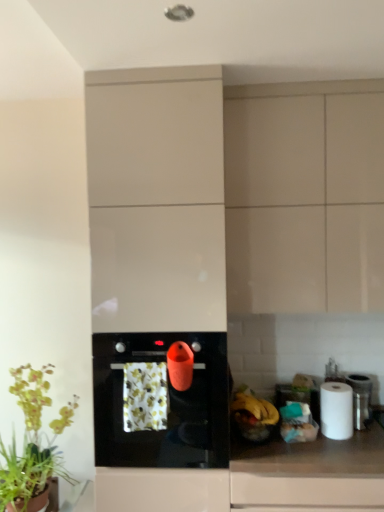
Measure the distance between floral-patterned fabric at center and camera.

floral-patterned fabric at center is 5.84 feet from camera.

Describe the element at coordinates (167, 403) in the screenshot. I see `black glossy oven at center` at that location.

Consider the image. What is the approximate height of white glossy countertop at lower right?

It is 25.28 inches.

Locate an element on the screen. green leafy plant at lower left is located at coordinates (33, 444).

Between white matte paper towel at right and black glossy oven at center, which one appears on the left side from the viewer's perspective?

Positioned to the left is black glossy oven at center.

Is point (336, 430) in front of point (199, 369)?

No, (336, 430) is further to viewer.

From the image's perspective, which one is positioned lower, white matte paper towel at right or black glossy oven at center?

white matte paper towel at right, from the image's perspective.

Can you confirm if yellow matte banana at lower right, which is counted as the 2th banana, starting from the right, is taller than floral-patterned fabric at center?

No.

How many degrees apart are the facing directions of yellow matte banana at lower right, which is counted as the 2th banana, starting from the right, and floral-patterned fabric at center?

35.8 degrees separate the facing orientations of yellow matte banana at lower right, which is counted as the 2th banana, starting from the right, and floral-patterned fabric at center.

Measure the distance from yellow matte banana at lower right, the 1th banana when ordered from left to right, to floral-patterned fabric at center.

yellow matte banana at lower right, the 1th banana when ordered from left to right, is 17.45 inches from floral-patterned fabric at center.

Is yellow matte banana at lower right, which is counted as the 2th banana, starting from the right, oriented towards floral-patterned fabric at center?

No, yellow matte banana at lower right, which is counted as the 2th banana, starting from the right, is not turned towards floral-patterned fabric at center.

Between white matte paper towel at right and yellow matte banana at lower right, the 1th banana when ordered from left to right, which one has smaller size?

yellow matte banana at lower right, the 1th banana when ordered from left to right.

How far apart are white matte paper towel at right and yellow matte banana at lower right, the 1th banana when ordered from left to right?

white matte paper towel at right is 11.81 inches away from yellow matte banana at lower right, the 1th banana when ordered from left to right.

From the picture: Is white matte paper towel at right at the left side of yellow matte banana at lower right, which is counted as the 2th banana, starting from the right?

No.

Is yellow matte banana at right, which is counted as the first banana, starting from the right, further to the viewer compared to yellow matte banana at lower right, which is counted as the 2th banana, starting from the right?

No.

From a real-world perspective, is yellow matte banana at right, which is counted as the first banana, starting from the right, positioned above or below yellow matte banana at lower right, the 1th banana when ordered from left to right?

Clearly, from a real-world perspective, yellow matte banana at right, which is counted as the first banana, starting from the right, is below yellow matte banana at lower right, the 1th banana when ordered from left to right.

Between yellow matte banana at right, which is the second banana from left to right, and yellow matte banana at lower right, the 1th banana when ordered from left to right, which one appears on the left side from the viewer's perspective?

yellow matte banana at lower right, the 1th banana when ordered from left to right.

Who is taller, yellow matte banana at right, which is counted as the first banana, starting from the right, or yellow matte banana at lower right, the 1th banana when ordered from left to right?

With more height is yellow matte banana at right, which is counted as the first banana, starting from the right.

Is white glossy cabinet at center, acting as the 1th cabinetry starting from the left, facing towards yellow matte banana at lower right, which is counted as the 2th banana, starting from the right?

No, white glossy cabinet at center, acting as the 1th cabinetry starting from the left, does not turn towards yellow matte banana at lower right, which is counted as the 2th banana, starting from the right.

Which object is positioned more to the right, white glossy cabinet at center, which is the second cabinetry from right to left, or yellow matte banana at lower right, the 1th banana when ordered from left to right?

yellow matte banana at lower right, the 1th banana when ordered from left to right.

Between white glossy cabinet at center, which is the second cabinetry from right to left, and yellow matte banana at lower right, the 1th banana when ordered from left to right, which one has smaller size?

Smaller between the two is yellow matte banana at lower right, the 1th banana when ordered from left to right.

Between point (87, 160) and point (271, 419), which one is positioned in front?

The point (271, 419) is more forward.

At what (x,y) coordinates should I click in order to perform the action: click on kitchen appliance lying below the floral-patterned fabric at center (from the image's perspective). Please return your answer as a coordinate pair (x, y). Looking at the image, I should click on (167, 403).

Is black glossy oven at center facing away from floral-patterned fabric at center?

Yes, black glossy oven at center is facing away from floral-patterned fabric at center.

From their relative heights in the image, would you say black glossy oven at center is taller or shorter than floral-patterned fabric at center?

Considering their sizes, black glossy oven at center has more height than floral-patterned fabric at center.

Between matte beige cabinet at upper right, acting as the 2th cabinetry starting from the left, and metallic silver canister at right, which one has larger size?

With larger size is matte beige cabinet at upper right, acting as the 2th cabinetry starting from the left.

From the image's perspective, is matte beige cabinet at upper right, the first cabinetry when ordered from right to left, located above metallic silver canister at right?

Correct, matte beige cabinet at upper right, the first cabinetry when ordered from right to left, appears higher than metallic silver canister at right in the image.

Is matte beige cabinet at upper right, acting as the 2th cabinetry starting from the left, looking in the opposite direction of metallic silver canister at right?

No, matte beige cabinet at upper right, acting as the 2th cabinetry starting from the left, is not facing away from metallic silver canister at right.

Where is `paper towel to the right of black glossy oven at center`? paper towel to the right of black glossy oven at center is located at coordinates (336, 410).

Identify the location of the 1st banana below the floral-patterned fabric at center (from the image's perspective). (255, 408).

Based on their spatial positions, is white matte paper towel at right or floral-patterned fabric at center further from white glossy cabinet at center, which is the second cabinetry from right to left?

white matte paper towel at right is further to white glossy cabinet at center, which is the second cabinetry from right to left.

From the image, which object appears to be farther from white glossy cabinet at center, which is the second cabinetry from right to left, yellow matte banana at lower right, the 1th banana when ordered from left to right, or yellow matte banana at right, which is the second banana from left to right?

yellow matte banana at right, which is the second banana from left to right.

Estimate the real-world distances between objects in this image. Which object is closer to yellow matte banana at right, which is the second banana from left to right, metallic silver canister at right or green leafy plant at lower left?

Among the two, metallic silver canister at right is located nearer to yellow matte banana at right, which is the second banana from left to right.

When comparing their distances from matte beige cabinet at upper right, acting as the 2th cabinetry starting from the left, does white glossy countertop at lower right or floral-patterned fabric at center seem closer?

Among the two, floral-patterned fabric at center is located nearer to matte beige cabinet at upper right, acting as the 2th cabinetry starting from the left.

From the image, which object appears to be nearer to white matte paper towel at right, white glossy cabinet at center, acting as the 1th cabinetry starting from the left, or white glossy countertop at lower right?

white glossy countertop at lower right.

When comparing their distances from black glossy oven at center, does white matte paper towel at right or floral-patterned fabric at center seem further?

Among the two, white matte paper towel at right is located further to black glossy oven at center.

When comparing their distances from white glossy cabinet at center, which is the second cabinetry from right to left, does yellow matte banana at lower right, which is counted as the 2th banana, starting from the right, or floral-patterned fabric at center seem further?

yellow matte banana at lower right, which is counted as the 2th banana, starting from the right, lies further to white glossy cabinet at center, which is the second cabinetry from right to left, than the other object.

Based on their spatial positions, is white matte paper towel at right or matte beige cabinet at upper right, the first cabinetry when ordered from right to left, closer to white glossy countertop at lower right?

white matte paper towel at right.

Locate an element on the screen. This screenshot has height=512, width=384. cabinetry between floral-patterned fabric at center and matte beige cabinet at upper right, the first cabinetry when ordered from right to left is located at coordinates (156, 199).

Find the location of a particular element. The width and height of the screenshot is (384, 512). kitchen appliance between matte beige cabinet at upper right, acting as the 2th cabinetry starting from the left, and yellow matte banana at right, which is the second banana from left to right, in the vertical direction is located at coordinates (167, 403).

You are a GUI agent. You are given a task and a screenshot of the screen. Output one action in this format:
    pyautogui.click(x=<x>, y=<y>)
    Task: Click on the paper towel located between white glossy cabinet at center, which is the second cabinetry from right to left, and metallic silver canister at right in the left-right direction
    The image size is (384, 512).
    Given the screenshot: What is the action you would take?
    pyautogui.click(x=336, y=410)

Locate an element on the screen. This screenshot has width=384, height=512. flower situated between green leafy plant at lower left and white matte paper towel at right from left to right is located at coordinates (145, 396).